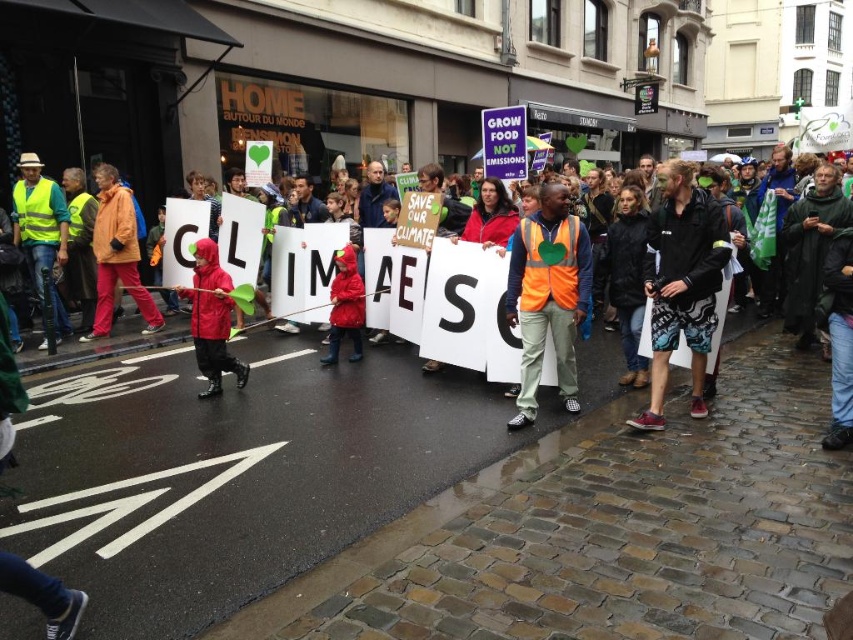
You are a photographer trying to capture a clear shot of the orange reflective vest at center and the orange fabric jacket at left. Which object should you focus on first if you want to ensure both are in frame without moving the camera?

The orange reflective vest at center is not as tall as the orange fabric jacket at left, so you should focus on the orange fabric jacket at left first to ensure both are in frame without moving the camera.

You are a photographer standing in the crowd at the climate protest. You want to take a photo of both the black synthetic jacket at center and the orange fabric jacket at left. Which jacket should you focus on first to ensure both are in the frame?

You should focus on the black synthetic jacket at center first since it is closer to the viewer than the orange fabric jacket at left, ensuring both are in the frame.